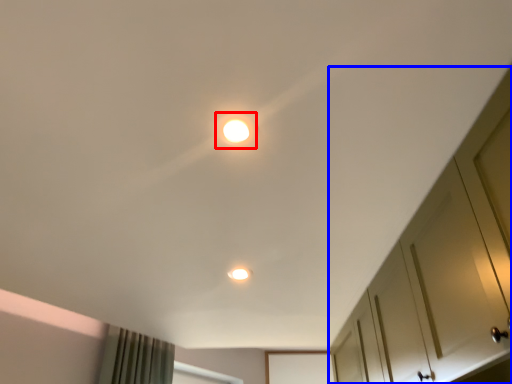
Question: Among these objects, which one is nearest to the camera, dot (highlighted by a red box) or dresser (highlighted by a blue box)?

Choices:
 (A) dot
 (B) dresser

Answer: (B)